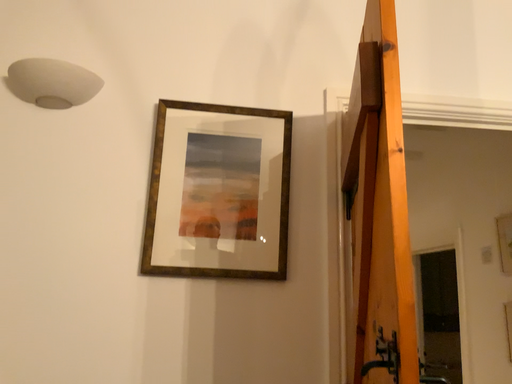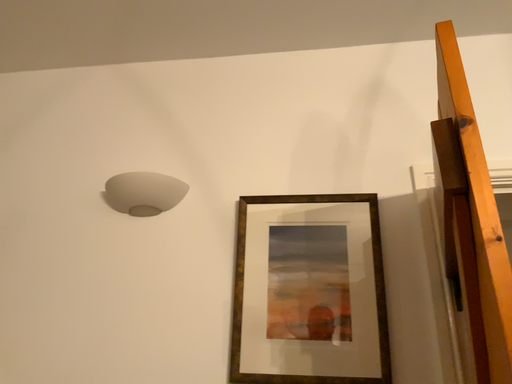
Question: Which way did the camera rotate in the video?

Choices:
 (A) rotated upward
 (B) rotated downward

Answer: (A)